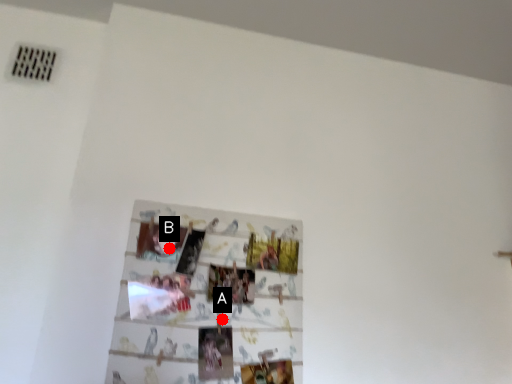
Question: Two points are circled on the image, labeled by A and B beside each circle. Which point appears farthest from the camera in this image?

Choices:
 (A) A is further
 (B) B is further

Answer: (B)